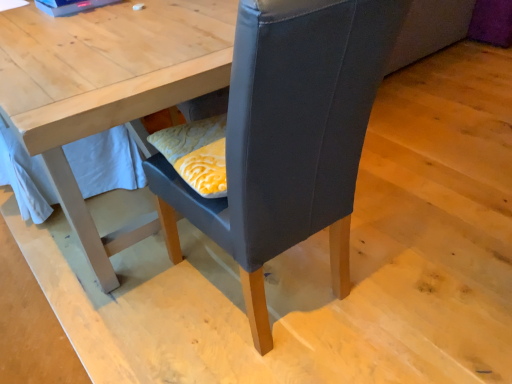
Find the location of a particular element. blank area to the left of matte black chair at center is located at coordinates (125, 298).